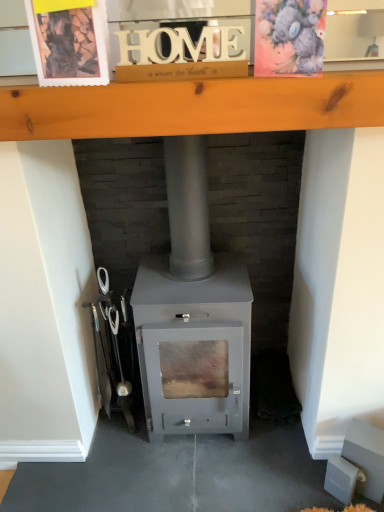
Locate an element on the screen. Image resolution: width=384 pixels, height=512 pixels. vacant area on top of wooden at upper center (from a real-world perspective) is located at coordinates 204,71.